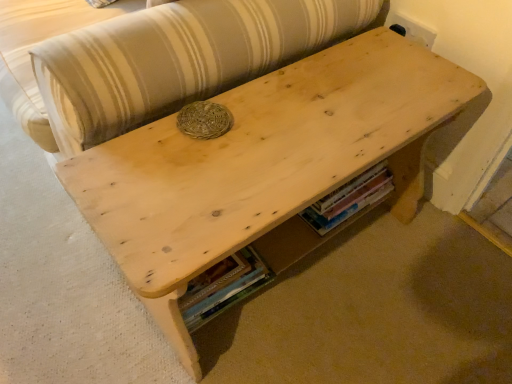
What is the approximate height of wooden book at lower center, the second book from the right?

wooden book at lower center, the second book from the right, is 5.71 inches tall.

This screenshot has width=512, height=384. Describe the element at coordinates (223, 287) in the screenshot. I see `wooden book at lower center, arranged as the 2th book when viewed from the top` at that location.

The width and height of the screenshot is (512, 384). I want to click on natural wood couch at upper center, so click(154, 58).

In the image, is wooden book at lower center, the second book from the right, positioned in front of or behind natural wood couch at upper center?

Clearly, wooden book at lower center, the second book from the right, is behind natural wood couch at upper center.

Is wooden book at lower center, the 1th book when ordered from left to right, facing away from natural wood couch at upper center?

wooden book at lower center, the 1th book when ordered from left to right, is not turned away from natural wood couch at upper center.

From the image's perspective, between wooden book at lower center, which appears as the 1th book when ordered from the bottom, and natural wood couch at upper center, which one is located above?

natural wood couch at upper center is shown above in the image.

Based on their sizes in the image, would you say wooden book at lower center, which appears as the 1th book when ordered from the bottom, is bigger or smaller than natural wood couch at upper center?

Considering their sizes, wooden book at lower center, which appears as the 1th book when ordered from the bottom, takes up less space than natural wood couch at upper center.

Is wooden book at lower center, the first book when ordered from top to bottom, directly adjacent to natural wood couch at upper center?

No.

Would you say wooden book at lower center, arranged as the second book when viewed from the left, is to the left or to the right of natural wood couch at upper center in the picture?

wooden book at lower center, arranged as the second book when viewed from the left, is to the right of natural wood couch at upper center.

From the image's perspective, between wooden book at lower center, arranged as the second book when viewed from the left, and natural wood couch at upper center, which one is located above?

From the image's view, natural wood couch at upper center is above.

Which book is the 2nd one when counting from the right side of the natural wood couch at upper center? Please provide its 2D coordinates.

[(349, 199)]

Based on the photo, can you confirm if wooden book at lower center, the second book from the right, is thinner than wooden book at lower center, the second book in the bottom-to-top sequence?

Incorrect, the width of wooden book at lower center, the second book from the right, is not less than that of wooden book at lower center, the second book in the bottom-to-top sequence.

Find the location of `book beneath the wooden book at lower center, which is counted as the first book, starting from the right (from a real-world perspective)`. book beneath the wooden book at lower center, which is counted as the first book, starting from the right (from a real-world perspective) is located at coordinates (223, 287).

Is wooden book at lower center, which appears as the 1th book when ordered from the bottom, turned away from wooden book at lower center, the first book when ordered from top to bottom?

wooden book at lower center, which appears as the 1th book when ordered from the bottom, is not turned away from wooden book at lower center, the first book when ordered from top to bottom.

Does wooden book at lower center, the second book from the right, have a smaller size compared to wooden book at lower center, the second book in the bottom-to-top sequence?

No.

Is natural wood couch at upper center positioned far away from wooden book at lower center, the second book from the right?

No, natural wood couch at upper center is not far away from wooden book at lower center, the second book from the right.

Can you confirm if natural wood couch at upper center is thinner than wooden book at lower center, which appears as the 1th book when ordered from the bottom?

Incorrect, the width of natural wood couch at upper center is not less than that of wooden book at lower center, which appears as the 1th book when ordered from the bottom.

At what (x,y) coordinates should I click in order to perform the action: click on the 1st book behind when counting from the natural wood couch at upper center. Please return your answer as a coordinate pair (x, y). Looking at the image, I should click on (223, 287).

From a real-world perspective, is natural wood couch at upper center on wooden book at lower center, the 1th book when ordered from left to right?

Indeed, from a real-world perspective, natural wood couch at upper center stands above wooden book at lower center, the 1th book when ordered from left to right.

Is wooden book at lower center, which is counted as the first book, starting from the right, bigger or smaller than wooden book at lower center, arranged as the 2th book when viewed from the top?

Considering their sizes, wooden book at lower center, which is counted as the first book, starting from the right, takes up less space than wooden book at lower center, arranged as the 2th book when viewed from the top.

Considering the points (335, 216) and (190, 291), which point is behind, point (335, 216) or point (190, 291)?

The point (335, 216) is farther from the camera.

Is wooden book at lower center, the second book in the bottom-to-top sequence, oriented away from wooden book at lower center, arranged as the 2th book when viewed from the top?

No, wooden book at lower center, arranged as the 2th book when viewed from the top, is not at the back of wooden book at lower center, the second book in the bottom-to-top sequence.

Between wooden book at lower center, the first book when ordered from top to bottom, and wooden book at lower center, the 1th book when ordered from left to right, which one has larger width?

wooden book at lower center, the 1th book when ordered from left to right.

Consider the image. Considering the sizes of objects natural wood couch at upper center and wooden book at lower center, the first book when ordered from top to bottom, in the image provided, who is wider, natural wood couch at upper center or wooden book at lower center, the first book when ordered from top to bottom,?

natural wood couch at upper center.

Considering the relative sizes of natural wood couch at upper center and wooden book at lower center, which is counted as the first book, starting from the right, in the image provided, is natural wood couch at upper center taller than wooden book at lower center, which is counted as the first book, starting from the right,?

Indeed, natural wood couch at upper center has a greater height compared to wooden book at lower center, which is counted as the first book, starting from the right.

Who is bigger, natural wood couch at upper center or wooden book at lower center, the second book in the bottom-to-top sequence?

With larger size is natural wood couch at upper center.

Based on the photo, is natural wood couch at upper center outside of wooden book at lower center, which is counted as the first book, starting from the right?

natural wood couch at upper center is positioned outside wooden book at lower center, which is counted as the first book, starting from the right.

Find the location of a particular element. The height and width of the screenshot is (384, 512). the 1st book counting from the right side of the natural wood couch at upper center is located at coordinates (223, 287).

This screenshot has height=384, width=512. Find the location of `couch located on the left of wooden book at lower center, arranged as the second book when viewed from the left`. couch located on the left of wooden book at lower center, arranged as the second book when viewed from the left is located at coordinates (154, 58).

Estimate the real-world distances between objects in this image. Which object is further from wooden book at lower center, the second book from the right, wooden book at lower center, the first book when ordered from top to bottom, or natural wood couch at upper center?

natural wood couch at upper center lies further to wooden book at lower center, the second book from the right, than the other object.

From the image, which object appears to be farther from wooden book at lower center, the 1th book when ordered from left to right, natural wood couch at upper center or wooden book at lower center, which is counted as the first book, starting from the right?

natural wood couch at upper center.

In the scene shown: Considering their positions, is wooden book at lower center, arranged as the second book when viewed from the left, positioned closer to natural wood couch at upper center than wooden book at lower center, which appears as the 1th book when ordered from the bottom?

wooden book at lower center, which appears as the 1th book when ordered from the bottom, is positioned closer to the anchor natural wood couch at upper center.

Considering their positions, is natural wood couch at upper center positioned closer to wooden book at lower center, which is counted as the first book, starting from the right, than wooden book at lower center, the second book from the right?

Among the two, wooden book at lower center, the second book from the right, is located nearer to wooden book at lower center, which is counted as the first book, starting from the right.

Consider the image. Estimate the real-world distances between objects in this image. Which object is further from natural wood couch at upper center, wooden book at lower center, which appears as the 1th book when ordered from the bottom, or wooden book at lower center, the first book when ordered from top to bottom?

wooden book at lower center, the first book when ordered from top to bottom, lies further to natural wood couch at upper center than the other object.

Considering their positions, is wooden book at lower center, arranged as the 2th book when viewed from the top, positioned further to wooden book at lower center, arranged as the second book when viewed from the left, than natural wood couch at upper center?

The object further to wooden book at lower center, arranged as the second book when viewed from the left, is natural wood couch at upper center.

This screenshot has width=512, height=384. In order to click on book between natural wood couch at upper center and wooden book at lower center, which appears as the 1th book when ordered from the bottom, from top to bottom in this screenshot , I will do `click(349, 199)`.